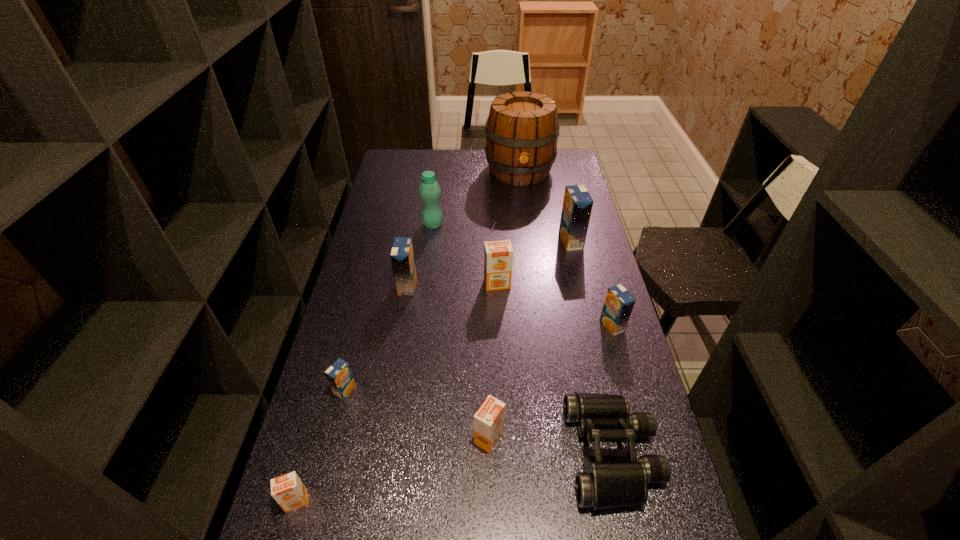
Locate an element on the screen. This screenshot has height=540, width=960. the second biggest orange orange juice is located at coordinates tap(489, 420).

At what (x,y) coordinates should I click in order to perform the action: click on the second nearest orange orange juice. Please return your answer as a coordinate pair (x, y). This screenshot has width=960, height=540. Looking at the image, I should click on pyautogui.click(x=489, y=420).

Where is `binoculars`? This screenshot has width=960, height=540. binoculars is located at coordinates point(608,481).

I want to click on the fifth farthest orange juice, so click(339, 375).

In order to click on the seventh farthest object in this screenshot , I will do pos(339,375).

Identify the location of the leftmost orange orange juice. (288, 490).

I want to click on the nearest orange juice, so click(288, 490).

I want to click on free location located on the side of the cider where the spigot is located, so click(x=528, y=237).

Image resolution: width=960 pixels, height=540 pixels. I want to click on vacant region located on the front of the second farthest object, so click(x=426, y=277).

At what (x,y) coordinates should I click in order to perform the action: click on vacant space located 0.130m on the back of the farthest blue orange_juice. Please return your answer as a coordinate pair (x, y). Looking at the image, I should click on (564, 212).